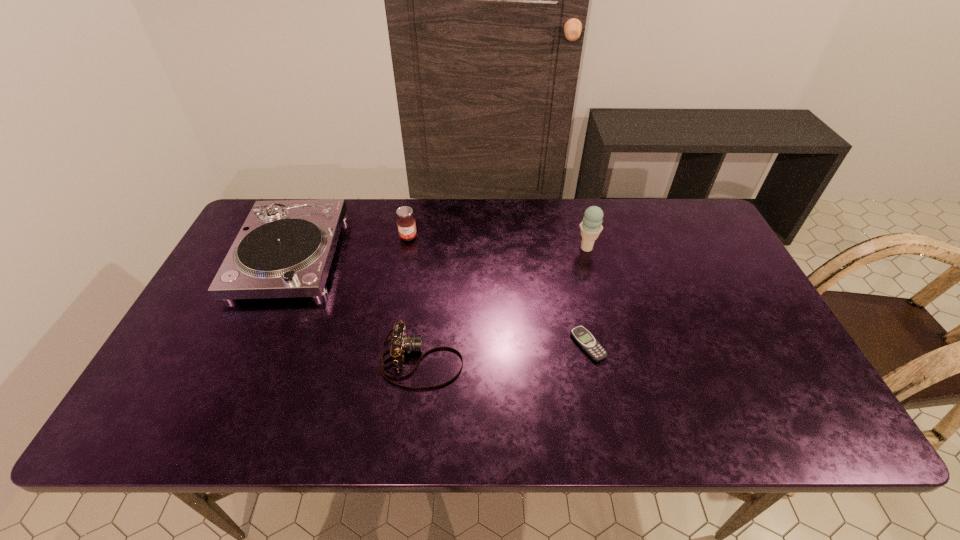
The width and height of the screenshot is (960, 540). In order to click on ice cream located at the far edge in this screenshot , I will do `click(590, 227)`.

This screenshot has height=540, width=960. I want to click on jam present at the far edge, so click(406, 224).

Find the location of `record player located at the far edge`. record player located at the far edge is located at coordinates (285, 248).

Where is `object that is at the left edge`? The image size is (960, 540). object that is at the left edge is located at coordinates [285, 248].

Where is `object that is at the far left corner`? The width and height of the screenshot is (960, 540). object that is at the far left corner is located at coordinates (285, 248).

Where is `free spot at the far edge of the desktop`? The width and height of the screenshot is (960, 540). free spot at the far edge of the desktop is located at coordinates point(506,245).

This screenshot has width=960, height=540. In the image, there is a desktop. In order to click on vacant space at the near edge in this screenshot , I will do `click(623, 429)`.

Find the location of `free region at the right edge of the desktop`. free region at the right edge of the desktop is located at coordinates (772, 353).

Identify the location of vacant space at the far right corner of the desktop. The image size is (960, 540). (692, 212).

In the image, there is a desktop. Where is `free space at the near right corner`? free space at the near right corner is located at coordinates (803, 426).